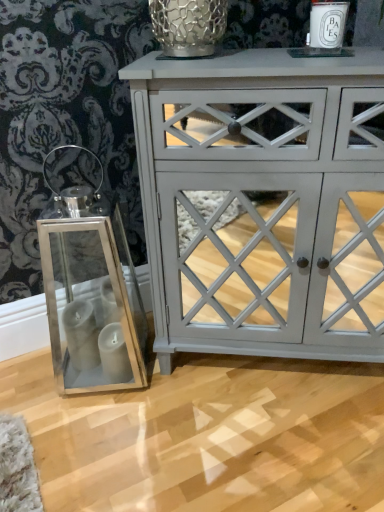
Question: From a real-world perspective, is matte gray cabinet at center physically located above or below metallic mesh glass vase at upper center?

Choices:
 (A) above
 (B) below

Answer: (B)

Question: Is point (292, 109) positioned closer to the camera than point (160, 14)?

Choices:
 (A) farther
 (B) closer

Answer: (B)

Question: Which object is the closest to the matte gray cabinet at center?

Choices:
 (A) metallic mesh glass vase at upper center
 (B) white ceramic candle at upper right

Answer: (A)

Question: Which object is the farthest from the white ceramic candle at upper right?

Choices:
 (A) metallic mesh glass vase at upper center
 (B) matte gray cabinet at center

Answer: (B)